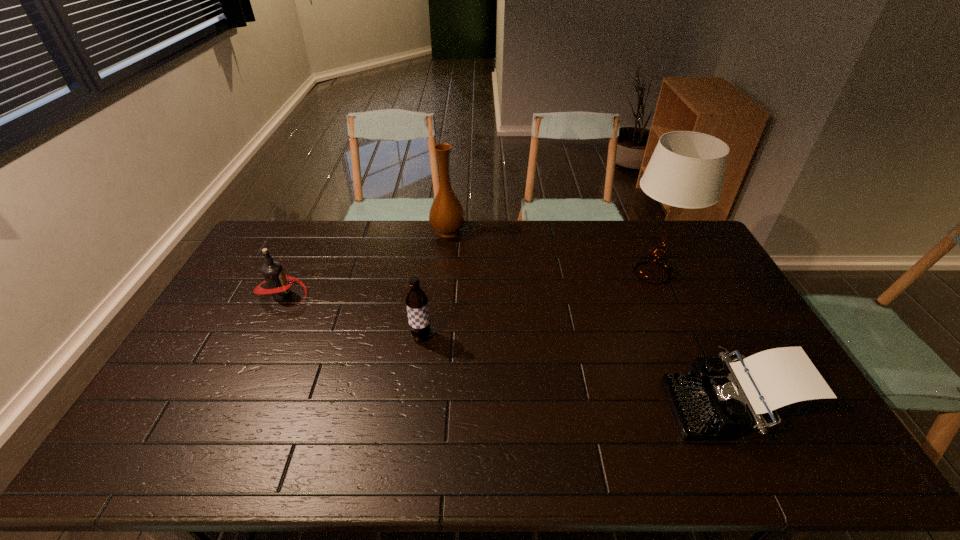
The width and height of the screenshot is (960, 540). I want to click on free point located 0.390m on the front-facing side of the table lamp, so click(508, 273).

Where is `vacant space situated 0.340m on the front-facing side of the table lamp`? vacant space situated 0.340m on the front-facing side of the table lamp is located at coordinates (522, 273).

At what (x,y) coordinates should I click in order to perform the action: click on free location located on the right of the vase. Please return your answer as a coordinate pair (x, y). Looking at the image, I should click on (554, 231).

Identify the location of vacant region located 0.140m on the front of the third tallest object. (415, 384).

At what (x,y) coordinates should I click in order to perform the action: click on vacant area situated on the label of the shorter root beer. Please return your answer as a coordinate pair (x, y). The image size is (960, 540). Looking at the image, I should click on (335, 295).

You are a GUI agent. You are given a task and a screenshot of the screen. Output one action in this format:
    pyautogui.click(x=<x>, y=<y>)
    Task: Click on the vacant space located 0.050m on the keys of the shortest object
    This screenshot has height=540, width=960.
    Given the screenshot: What is the action you would take?
    pyautogui.click(x=650, y=406)

The width and height of the screenshot is (960, 540). I want to click on vacant space located 0.290m on the keys of the shortest object, so click(x=558, y=406).

The height and width of the screenshot is (540, 960). What are the coordinates of `vacant region located 0.180m on the keys of the shortest object` in the screenshot? It's located at (600, 406).

Identify the location of table lamp present at the far edge. (686, 170).

Find the location of a particular element. vase located at the far edge is located at coordinates pos(447,217).